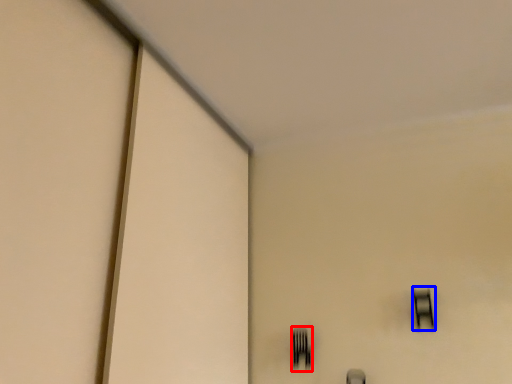
Question: Which point is closer to the camera, fork (highlighted by a red box) or window (highlighted by a blue box)?

Choices:
 (A) fork
 (B) window

Answer: (B)